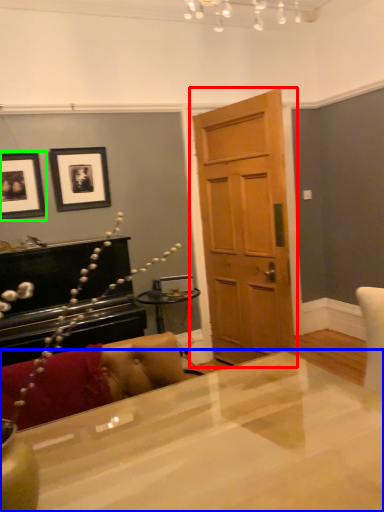
Question: Which object is positioned closest to door (highlighted by a red box)? Select from desk (highlighted by a blue box) and picture frame (highlighted by a green box).

Choices:
 (A) desk
 (B) picture frame

Answer: (B)